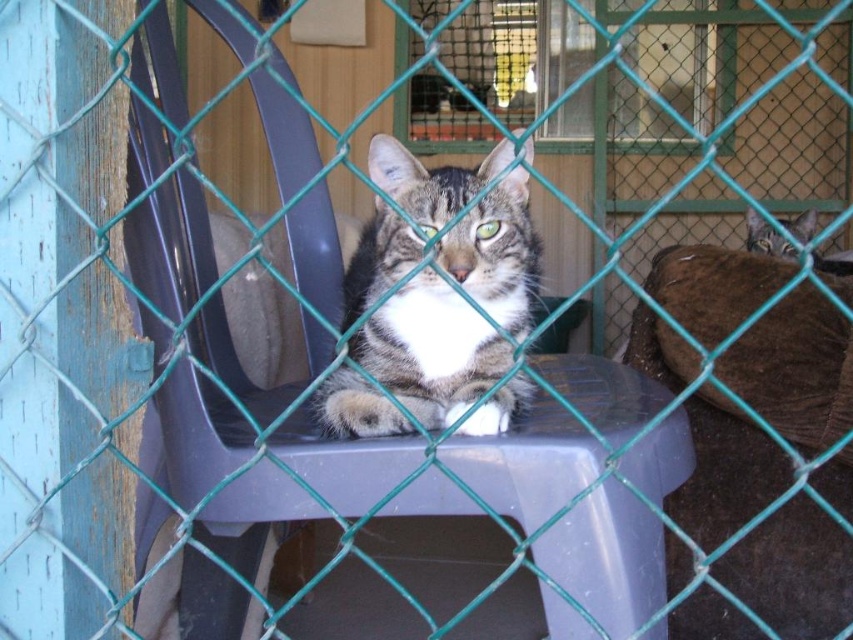
You are a photographer trying to capture the tabby fur cat at center in the image. The camera you are using has a focus point at coordinate point (x=430, y=349). Will this point help you focus on the cat?

Yes, because the point (x=430, y=349) is on the tabby fur cat at center, so it will help focus on the cat.

You are a photographer trying to capture both cats in the scene. The tabby fur cat at center and the tabby fur cat at upper right. Given their sizes in the image, which cat should you focus on first to ensure both are in frame?

The tabby fur cat at center is much taller than the tabby fur cat at upper right, so focusing on the taller cat first will help ensure both are in frame.